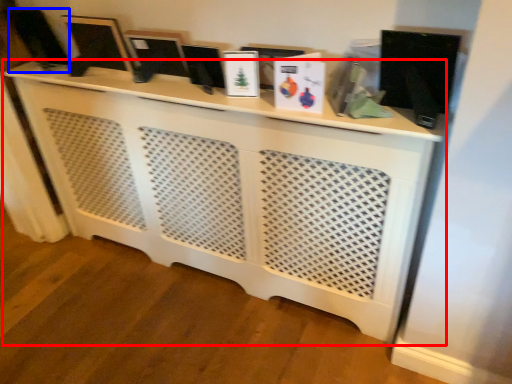
Question: Which object is further to the camera taking this photo, furniture (highlighted by a red box) or computer monitor (highlighted by a blue box)?

Choices:
 (A) furniture
 (B) computer monitor

Answer: (B)